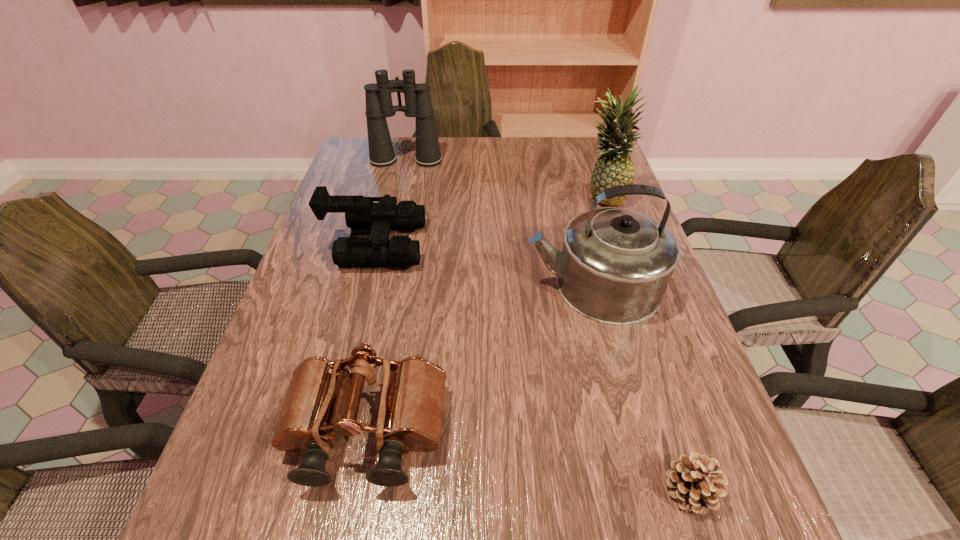
Identify the location of blank space at the near edge of the desktop. (320, 519).

This screenshot has height=540, width=960. In the image, there is a desktop. What are the coordinates of `free region at the left edge` in the screenshot? It's located at (348, 349).

In the image, there is a desktop. Identify the location of vacant region at the right edge. (637, 455).

In the image, there is a desktop. What are the coordinates of `free space at the far left corner` in the screenshot? It's located at (353, 166).

At what (x,y) coordinates should I click in order to perform the action: click on vacant space at the far right corner of the desktop. Please return your answer as a coordinate pair (x, y). Looking at the image, I should click on (593, 161).

Identify the location of free space between the nearest binoculars and the farthest binoculars. (386, 296).

Identify the location of vacant area between the kettle and the nearest binoculars. (479, 359).

The width and height of the screenshot is (960, 540). Identify the location of empty location between the second nearest binoculars and the second farthest object. (489, 221).

Locate an element on the screen. free spot between the nearest binoculars and the second nearest binoculars is located at coordinates (371, 338).

Where is `free point between the shortest object and the second farthest binoculars`? This screenshot has width=960, height=540. free point between the shortest object and the second farthest binoculars is located at coordinates (532, 367).